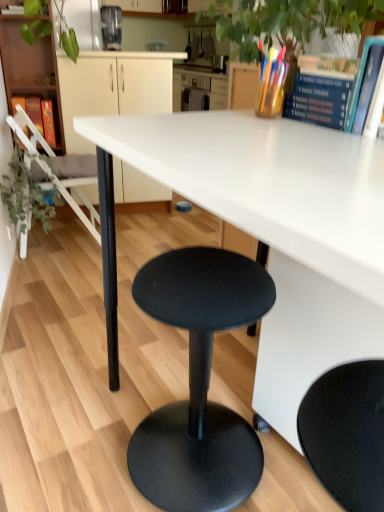
Question: Is blue hardcover book at upper right, which is counted as the third book, starting from the top, turned away from hardcover book at left, which is the 3th book from front to back?

Choices:
 (A) yes
 (B) no

Answer: (B)

Question: Is the depth of blue hardcover book at upper right, the first book in the bottom-to-top sequence, greater than that of hardcover book at left, positioned as the first book in back-to-front order?

Choices:
 (A) no
 (B) yes

Answer: (A)

Question: Does blue hardcover book at upper right, which is counted as the third book, starting from the top, appear on the right side of hardcover book at left, positioned as the first book in back-to-front order?

Choices:
 (A) yes
 (B) no

Answer: (A)

Question: Is blue hardcover book at upper right, the first book in the bottom-to-top sequence, to the left of hardcover book at left, which is the 3th book from front to back, from the viewer's perspective?

Choices:
 (A) no
 (B) yes

Answer: (A)

Question: Can you confirm if blue hardcover book at upper right, the first book in the bottom-to-top sequence, is shorter than hardcover book at left, which is the 3th book from front to back?

Choices:
 (A) yes
 (B) no

Answer: (A)

Question: Is blue hardcover book at upper right, which is counted as the third book, starting from the top, closer to camera compared to hardcover book at left, which is counted as the 3th book, starting from the right?

Choices:
 (A) yes
 (B) no

Answer: (A)

Question: Can you confirm if green leafy plant at left is thinner than blue hardcover book at upper right, the 3th book positioned from the left?

Choices:
 (A) yes
 (B) no

Answer: (B)

Question: Considering the relative sizes of green leafy plant at left and blue hardcover book at upper right, the 2th book in the top-to-bottom sequence, in the image provided, is green leafy plant at left smaller than blue hardcover book at upper right, the 2th book in the top-to-bottom sequence,?

Choices:
 (A) no
 (B) yes

Answer: (A)

Question: Is blue hardcover book at upper right, the 3th book positioned from the left, surrounded by green leafy plant at left?

Choices:
 (A) no
 (B) yes

Answer: (A)

Question: Is green leafy plant at left positioned with its back to blue hardcover book at upper right, the 1th book viewed from the front?

Choices:
 (A) yes
 (B) no

Answer: (B)

Question: Is green leafy plant at left located outside blue hardcover book at upper right, the 2th book in the top-to-bottom sequence?

Choices:
 (A) yes
 (B) no

Answer: (A)

Question: Is green leafy plant at left to the right of blue hardcover book at upper right, the 3th book from the back, from the viewer's perspective?

Choices:
 (A) no
 (B) yes

Answer: (A)

Question: Does blue hardcover book at upper right, the 2th book in the top-to-bottom sequence, have a greater height compared to white matte desk at center?

Choices:
 (A) no
 (B) yes

Answer: (A)